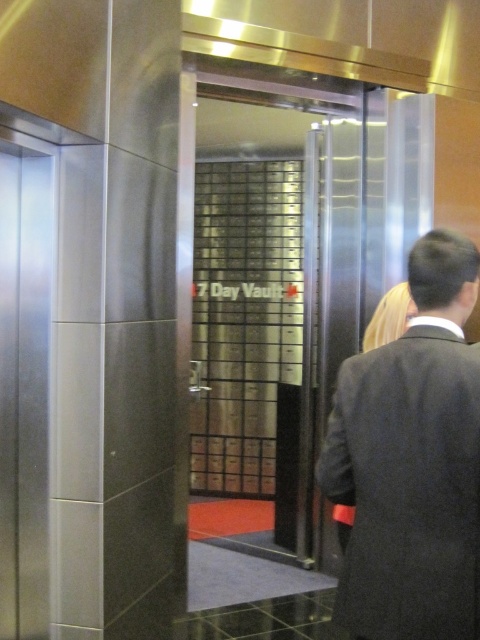
You are standing in front of the vault and want to enter. Where should you approach to open the clear glass door at center?

The clear glass door at center is located at point coordinates (x=273, y=296), so you should approach that position to open it.

You are a security guard in the facility and need to check the clear glass door at center and the dark gray suit at right. Which object is taller?

The clear glass door at center is much taller than the dark gray suit at right.

You are a security guard standing in front of the clear glass door at center and the dark gray suit at right. You need to inspect both items. Which one should you check first if you must start from the nearest object?

The dark gray suit at right should be checked first because it is closer to you than the clear glass door at center, which is located above it.